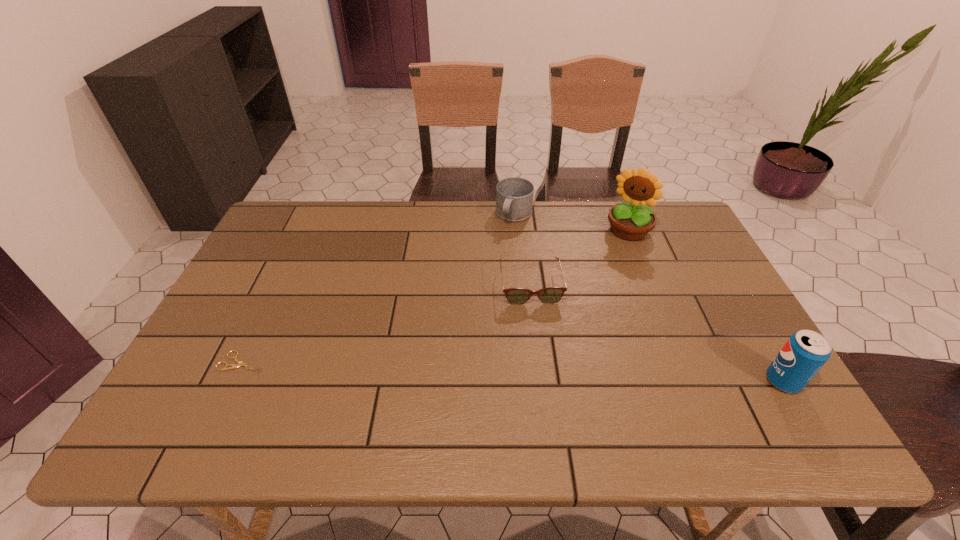
Where is `shears`? shears is located at coordinates (240, 363).

Identify the location of the shortest object. This screenshot has height=540, width=960. (240, 363).

The height and width of the screenshot is (540, 960). What are the coordinates of `the fourth shortest object` in the screenshot? It's located at (806, 351).

Identify the location of the rightmost object. The height and width of the screenshot is (540, 960). (806, 351).

In order to click on spectacles in this screenshot , I will do `click(517, 296)`.

Where is `the second shortest object`? The image size is (960, 540). the second shortest object is located at coordinates (517, 296).

Locate an element on the screen. sunflower is located at coordinates (632, 220).

At what (x,y) coordinates should I click in order to perform the action: click on the fourth object from left to right. Please return your answer as a coordinate pair (x, y). Looking at the image, I should click on (632, 220).

The width and height of the screenshot is (960, 540). I want to click on mug, so click(x=514, y=196).

The height and width of the screenshot is (540, 960). What are the coordinates of `vacant space situated on the back of the shears` in the screenshot? It's located at (287, 269).